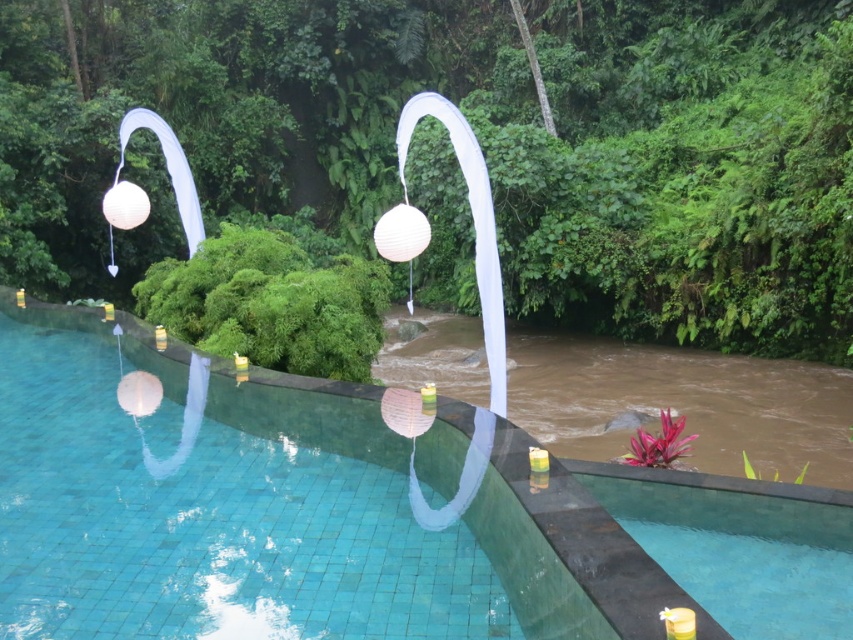
Who is shorter, green leafy tree at upper center or transparent glass pool at center?

transparent glass pool at center is shorter.

Locate an element on the screen. This screenshot has height=640, width=853. green leafy tree at upper center is located at coordinates (479, 138).

Which is in front, point (601, 24) or point (544, 563)?

Point (544, 563) is more forward.

Where is `green leafy tree at upper center`? Image resolution: width=853 pixels, height=640 pixels. green leafy tree at upper center is located at coordinates (479, 138).